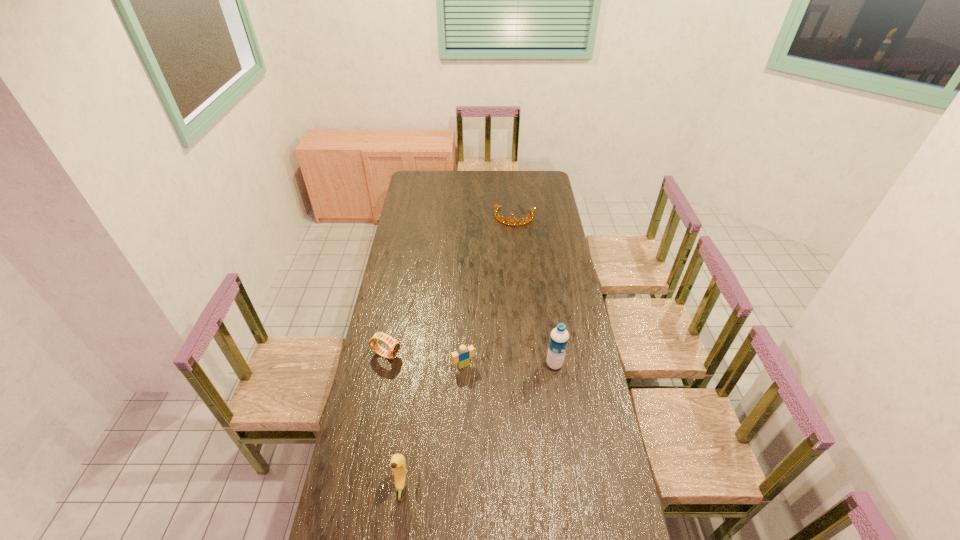
Identify the location of free point between the Lego and the leftmost object. pyautogui.click(x=425, y=360).

Image resolution: width=960 pixels, height=540 pixels. Identify the location of unoccupied position between the tiara and the Lego. (489, 291).

Find the location of a particular element. This screenshot has height=540, width=960. blank region between the tallest object and the fourth shortest object is located at coordinates (478, 425).

The width and height of the screenshot is (960, 540). Identify the location of vacant area that lies between the water bottle and the shortest object. (535, 291).

Identify which object is located as the fourth nearest to the water bottle. Please provide its 2D coordinates. Your answer should be formatted as a tuple, i.e. [(x, y)], where the tuple contains the x and y coordinates of a point satisfying the conditions above.

[(496, 207)]

This screenshot has width=960, height=540. In order to click on object that is the fourth closest one to the Lego in this screenshot , I will do `click(496, 207)`.

Find the location of `vacant space that satisfies the following two spatial constraints: 1. on the back side of the third object from left to right; 2. on the label of the water bottle`. vacant space that satisfies the following two spatial constraints: 1. on the back side of the third object from left to right; 2. on the label of the water bottle is located at coordinates pos(464,364).

The width and height of the screenshot is (960, 540). Identify the location of vacant space that satisfies the following two spatial constraints: 1. on the front side of the watch; 2. on the label of the water bottle. (385, 364).